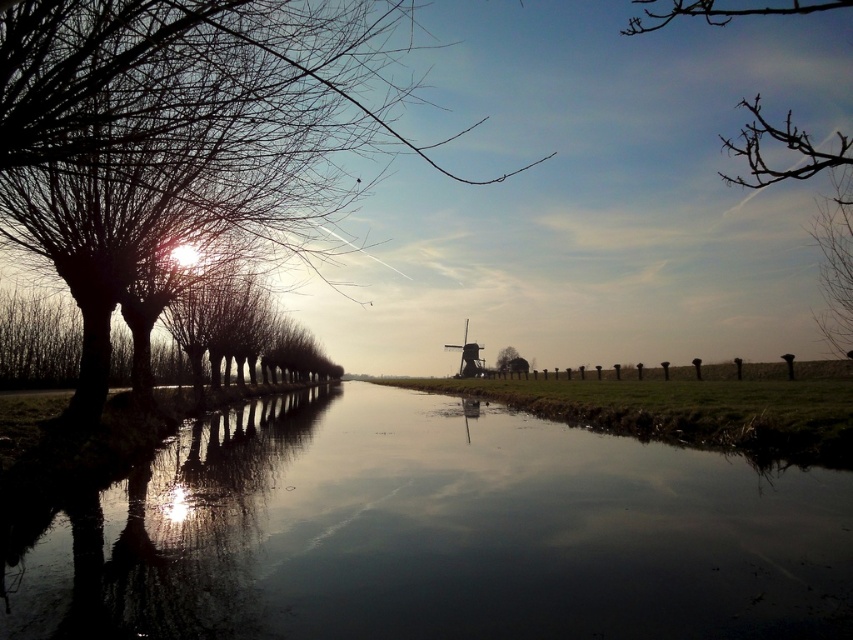
Question: Where is silhouette bare tree at left located in relation to green matte tree at center in the image?

Choices:
 (A) above
 (B) below

Answer: (A)

Question: Which point is closer to the camera?

Choices:
 (A) (517, 369)
 (B) (82, 536)
 (C) (155, 131)
 (D) (769, 131)

Answer: (C)

Question: Where is silhouette bare tree at left located in relation to green matte tree at center in the image?

Choices:
 (A) above
 (B) below

Answer: (A)

Question: Which point is closer to the camera taking this photo?

Choices:
 (A) (18, 132)
 (B) (500, 356)

Answer: (A)

Question: Is silhouette bare tree at left bigger than green matte tree at center?

Choices:
 (A) no
 (B) yes

Answer: (B)

Question: Which point is closer to the camera taking this photo?

Choices:
 (A) (263, 97)
 (B) (247, 547)
 (C) (514, 352)

Answer: (B)